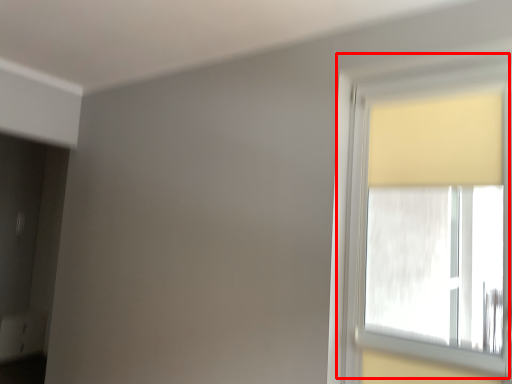
Question: Considering the relative positions of window (annotated by the red box) and curtain in the image provided, where is window (annotated by the red box) located with respect to the staircase?

Choices:
 (A) right
 (B) left

Answer: (B)